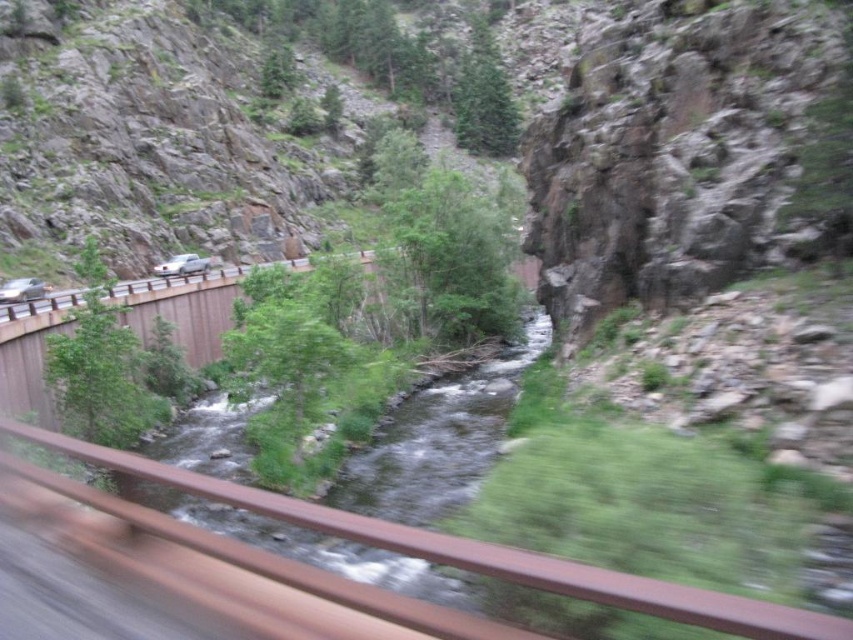
This screenshot has height=640, width=853. I want to click on green grassy river at center, so click(x=436, y=442).

Which is in front, point (419, 449) or point (630, 582)?

Point (630, 582)

What are the coordinates of `green grassy river at center` in the screenshot? It's located at (436, 442).

The height and width of the screenshot is (640, 853). What are the coordinates of `green grassy river at center` in the screenshot? It's located at (436, 442).